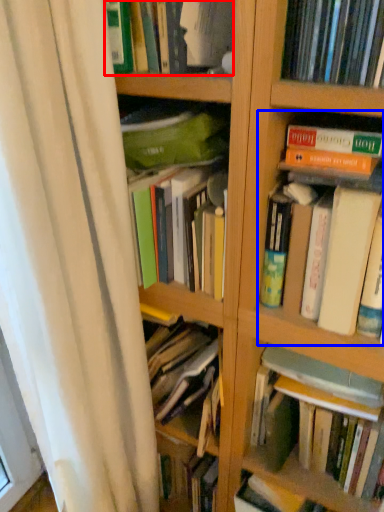
Question: Which of the following is the closest to the observer, book (highlighted by a red box) or book (highlighted by a blue box)?

Choices:
 (A) book
 (B) book

Answer: (B)